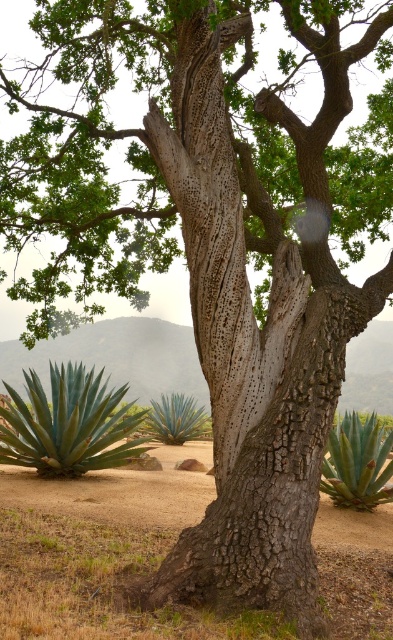
Who is shorter, brown dirt field at center or green succulent at center?

With less height is brown dirt field at center.

Is brown dirt field at center smaller than green succulent at center?

Indeed, brown dirt field at center has a smaller size compared to green succulent at center.

Is point (376, 520) positioned behind point (167, 406)?

No.

Identify the location of brown dirt field at center. (97, 550).

Is point (387, 477) positioned after point (179, 394)?

No, (387, 477) is closer to viewer.

Is green succulent at lower right smaller than green succulent at center?

Yes, green succulent at lower right is smaller than green succulent at center.

Is point (339, 468) farther from viewer compared to point (196, 408)?

No, (339, 468) is closer to viewer.

I want to click on green succulent at lower right, so click(x=358, y=464).

Who is shorter, brown dirt field at center or green succulent at lower right?

brown dirt field at center

Who is taller, brown dirt field at center or green succulent at lower right?

Standing taller between the two is green succulent at lower right.

Is point (132, 497) less distant than point (391, 474)?

No.

Image resolution: width=393 pixels, height=640 pixels. I want to click on brown dirt field at center, so click(x=97, y=550).